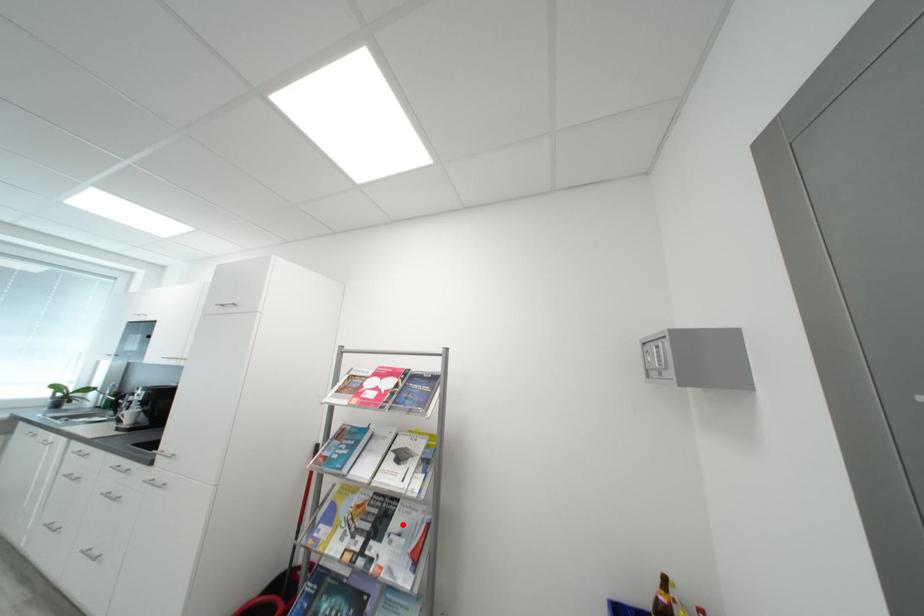
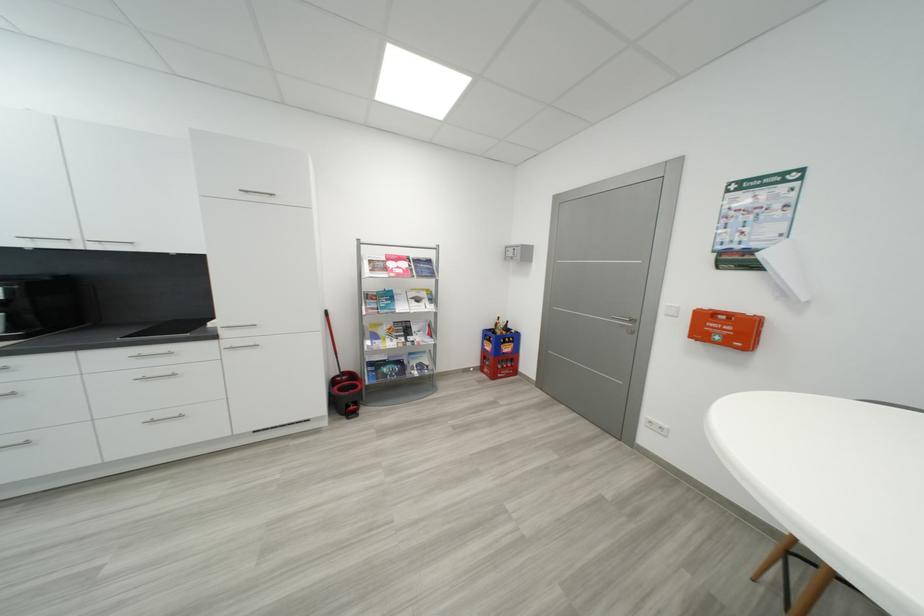
Question: I am providing you with two images of the same scene from different viewpoints. A red point is shown in image1. For the corresponding object point in image2, is it positioned nearer or farther from the camera?

Choices:
 (A) Nearer
 (B) Farther

Answer: (A)